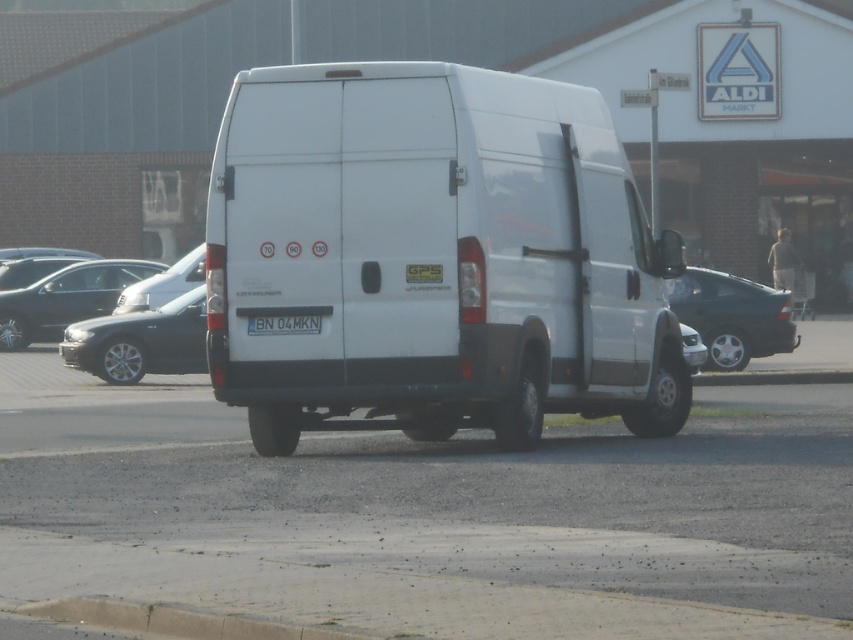
Looking at this image, does satin black sedan at left have a greater width compared to gray concrete curb at lower center?

Indeed, satin black sedan at left has a greater width compared to gray concrete curb at lower center.

Can you confirm if satin black sedan at left is taller than gray concrete curb at lower center?

Yes, satin black sedan at left is taller than gray concrete curb at lower center.

Is point (189, 365) more distant than point (173, 605)?

Yes, it is.

Find the location of `satin black sedan at left`. satin black sedan at left is located at coordinates (140, 340).

Which of these two, shiny black sedan at center or white matte license plate at center, stands shorter?

white matte license plate at center is shorter.

Is point (740, 355) closer to camera compared to point (283, 321)?

No.

This screenshot has height=640, width=853. What are the coordinates of `shiny black sedan at center` in the screenshot? It's located at pyautogui.click(x=733, y=316).

Consider the image. Between shiny black sedan at center and satin silver sedan at center, which one is positioned lower?

shiny black sedan at center

Between shiny black sedan at center and satin silver sedan at center, which one appears on the left side from the viewer's perspective?

satin silver sedan at center is more to the left.

Where is `shiny black sedan at center`? shiny black sedan at center is located at coordinates (733, 316).

Where is `shiny black sedan at center`? This screenshot has height=640, width=853. shiny black sedan at center is located at coordinates (733, 316).